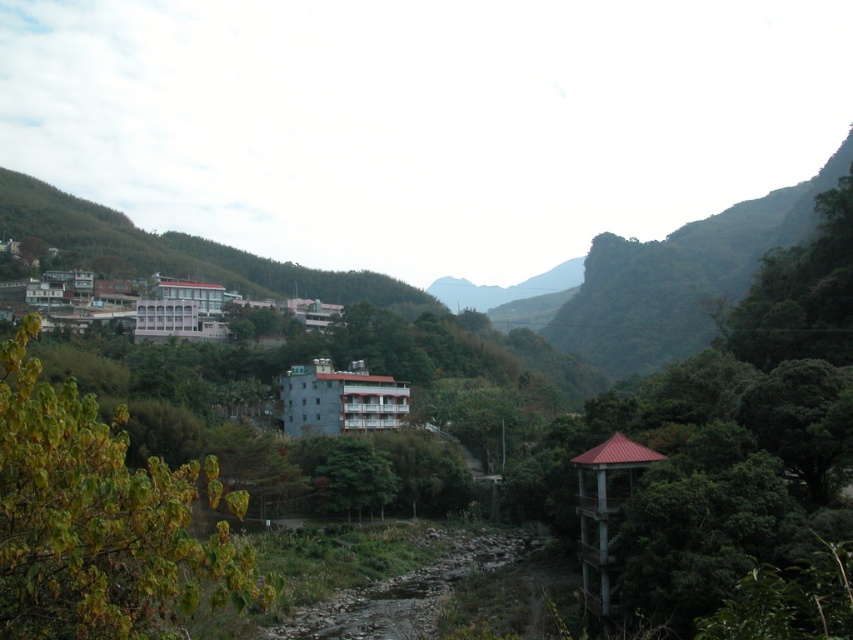
Describe the element at coordinates (102, 520) in the screenshot. I see `green leafy tree at left` at that location.

Locate an element on the screen. The image size is (853, 640). green leafy tree at left is located at coordinates (102, 520).

Where is `green leafy tree at left`? This screenshot has width=853, height=640. green leafy tree at left is located at coordinates (102, 520).